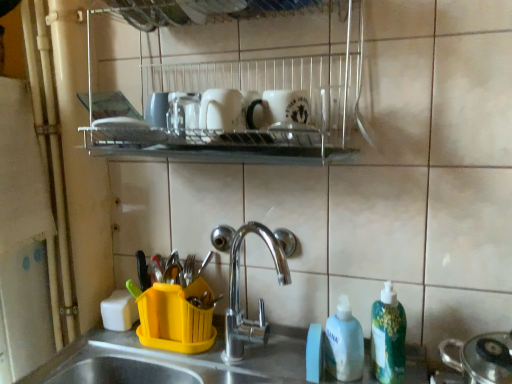
Question: Considering the positions of point (353, 331) and point (282, 105), is point (353, 331) closer or farther from the camera than point (282, 105)?

Choices:
 (A) farther
 (B) closer

Answer: (A)

Question: Is white matte bottle at lower right, which is the second cleaning product from right to left, in front of or behind metallic wire rack at upper center in the image?

Choices:
 (A) front
 (B) behind

Answer: (B)

Question: Estimate the real-world distances between objects in this image. Which object is farther from the metallic silver pot at lower right?

Choices:
 (A) white matte bottle at lower right, arranged as the first cleaning product when viewed from the left
 (B) white matte mug at upper center, which ranks as the second mug in left-to-right order
 (C) metallic wire rack at upper center
 (D) white glossy mug at upper center, which is the 1th mug from left to right
 (E) yellow plastic utensil holder at lower center

Answer: (C)

Question: Which of these objects is positioned closest to the metallic wire rack at upper center?

Choices:
 (A) white matte bottle at lower right, arranged as the first cleaning product when viewed from the left
 (B) white matte mug at upper center, acting as the first mug starting from the right
 (C) green plastic bottle at lower right, which ranks as the first cleaning product in right-to-left order
 (D) white glossy mug at upper center, which appears as the 2th mug when viewed from the right
 (E) metallic silver pot at lower right

Answer: (B)